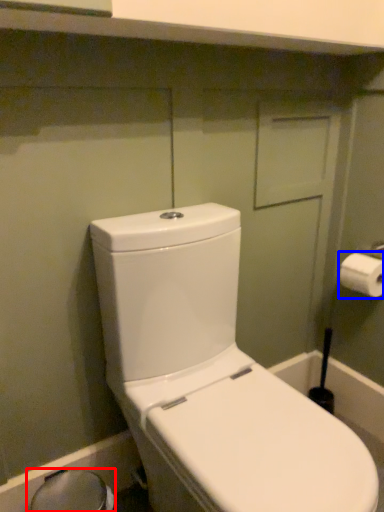
Question: Which object is closer to the camera taking this photo, bidet (highlighted by a red box) or toilet paper (highlighted by a blue box)?

Choices:
 (A) bidet
 (B) toilet paper

Answer: (A)